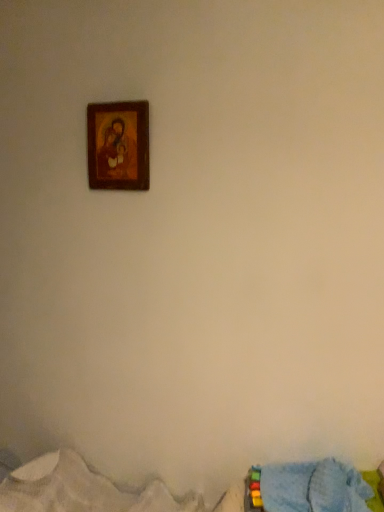
Question: From a real-world perspective, is wooden frame at upper center physically above blue textured blanket at lower right, arranged as the first bed when ordered from the bottom?

Choices:
 (A) no
 (B) yes

Answer: (B)

Question: Could you tell me if wooden frame at upper center is turned towards blue textured blanket at lower right, which is counted as the second bed, starting from the top?

Choices:
 (A) no
 (B) yes

Answer: (A)

Question: From the image's perspective, is wooden frame at upper center above blue textured blanket at lower right, arranged as the first bed when ordered from the bottom?

Choices:
 (A) no
 (B) yes

Answer: (B)

Question: Is blue textured blanket at lower right, which is counted as the second bed, starting from the top, inside wooden frame at upper center?

Choices:
 (A) yes
 (B) no

Answer: (B)

Question: Is wooden frame at upper center to the right of blue textured blanket at lower right, which is counted as the second bed, starting from the top, from the viewer's perspective?

Choices:
 (A) yes
 (B) no

Answer: (B)

Question: Considering the relative sizes of wooden frame at upper center and blue textured blanket at lower right, which is counted as the second bed, starting from the top, in the image provided, is wooden frame at upper center taller than blue textured blanket at lower right, which is counted as the second bed, starting from the top,?

Choices:
 (A) no
 (B) yes

Answer: (B)

Question: Can you confirm if blue textured blanket at lower right, which is counted as the second bed, starting from the top, is shorter than wooden frame at upper center?

Choices:
 (A) yes
 (B) no

Answer: (A)

Question: From a real-world perspective, is blue textured blanket at lower right, arranged as the first bed when ordered from the bottom, under wooden frame at upper center?

Choices:
 (A) no
 (B) yes

Answer: (B)

Question: Considering the relative sizes of blue textured blanket at lower right, arranged as the first bed when ordered from the bottom, and wooden frame at upper center in the image provided, is blue textured blanket at lower right, arranged as the first bed when ordered from the bottom, wider than wooden frame at upper center?

Choices:
 (A) no
 (B) yes

Answer: (B)

Question: Would you say wooden frame at upper center is part of blue textured blanket at lower right, which is counted as the second bed, starting from the top,'s contents?

Choices:
 (A) no
 (B) yes

Answer: (A)

Question: From the image's perspective, does blue textured blanket at lower right, which is counted as the second bed, starting from the top, appear higher than wooden frame at upper center?

Choices:
 (A) no
 (B) yes

Answer: (A)

Question: Is blue textured blanket at lower right, arranged as the first bed when ordered from the bottom, oriented towards wooden frame at upper center?

Choices:
 (A) yes
 (B) no

Answer: (B)

Question: Is blue fabric bed at lower right, which is the second bed from bottom to top, thinner than blue textured blanket at lower right, arranged as the first bed when ordered from the bottom?

Choices:
 (A) yes
 (B) no

Answer: (A)